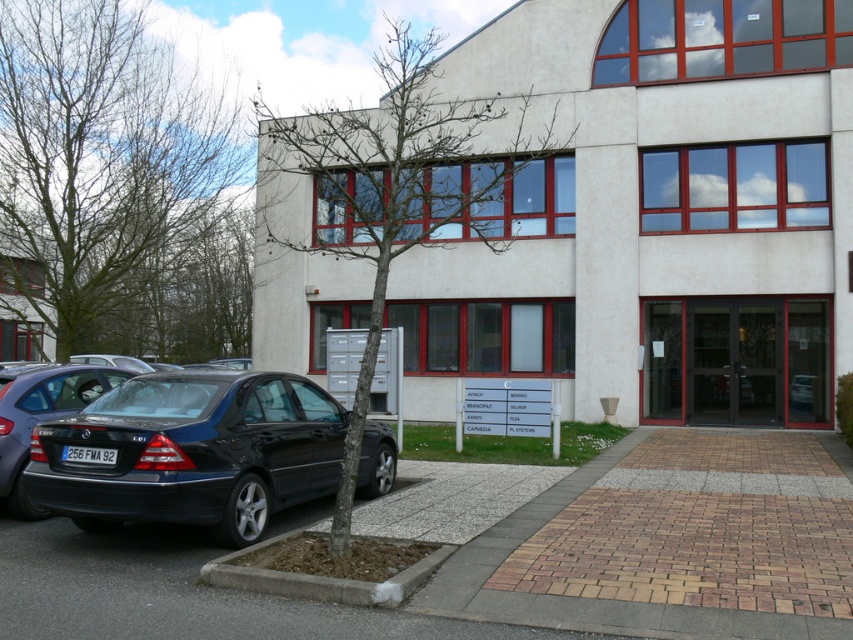
You are a delivery person trying to park your 3.5 meter long van in the paved area near the building. The van needs to be parked between the bare branches at center and the concrete at lower left. Is there enough space for the van to fit between them?

The distance between the bare branches at center and the concrete at lower left is 8.58 meters, which is more than enough to accommodate a 3.5 meter long van.

You are standing at the entrance of the modern building and want to find the signboard with the company names. According to the image, where should you look relative to the green leafless tree at left?

The signboard is near the green leafless tree at left, so you should look near the green leafless tree at left to find the signboard with the company names.